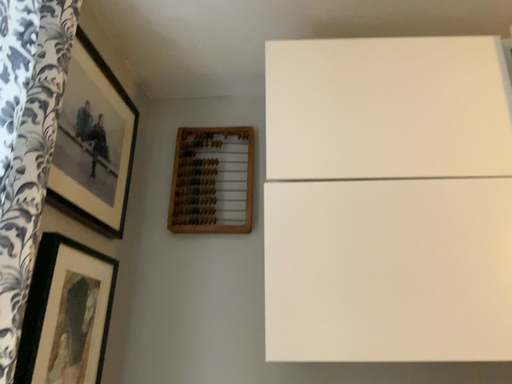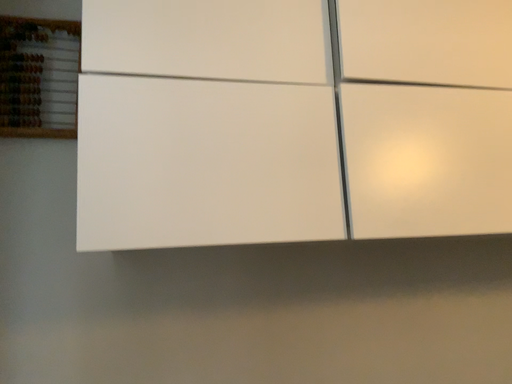
Question: Which way did the camera rotate in the video?

Choices:
 (A) rotated upward
 (B) rotated downward

Answer: (B)